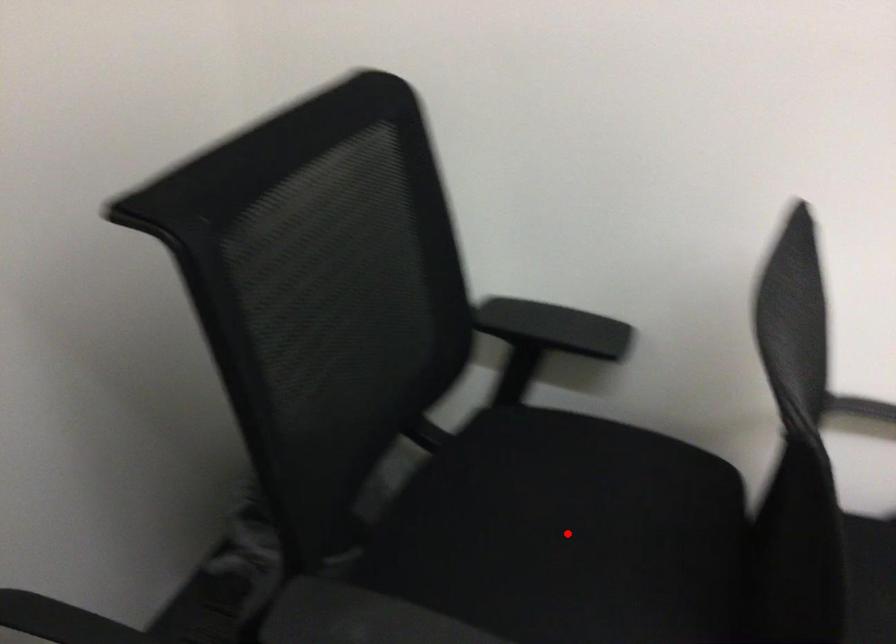
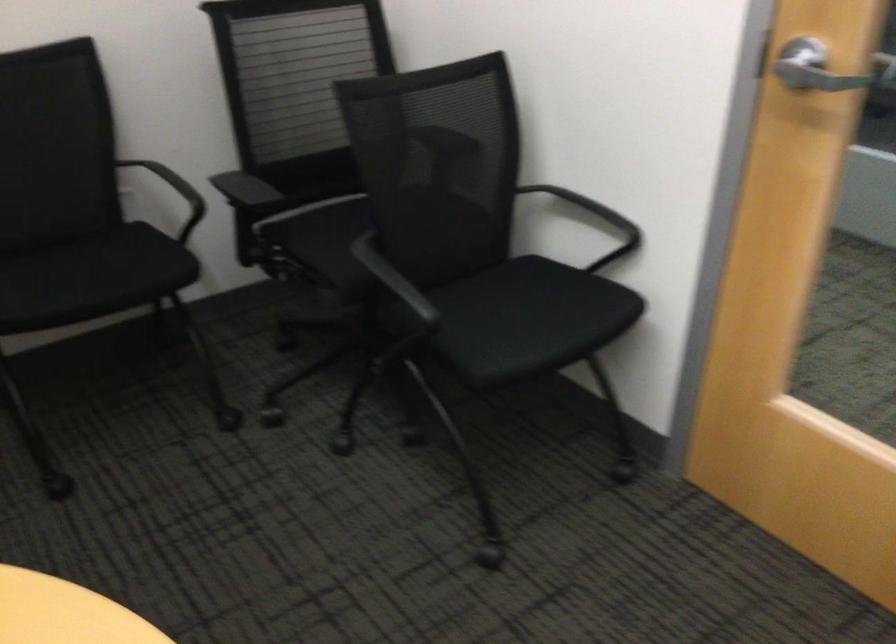
Question: I am providing you with two images of the same scene from different viewpoints. A red point is marked on the first image. At the location where the point appears in image 1, is it still visible in image 2?

Choices:
 (A) Yes
 (B) No

Answer: (B)